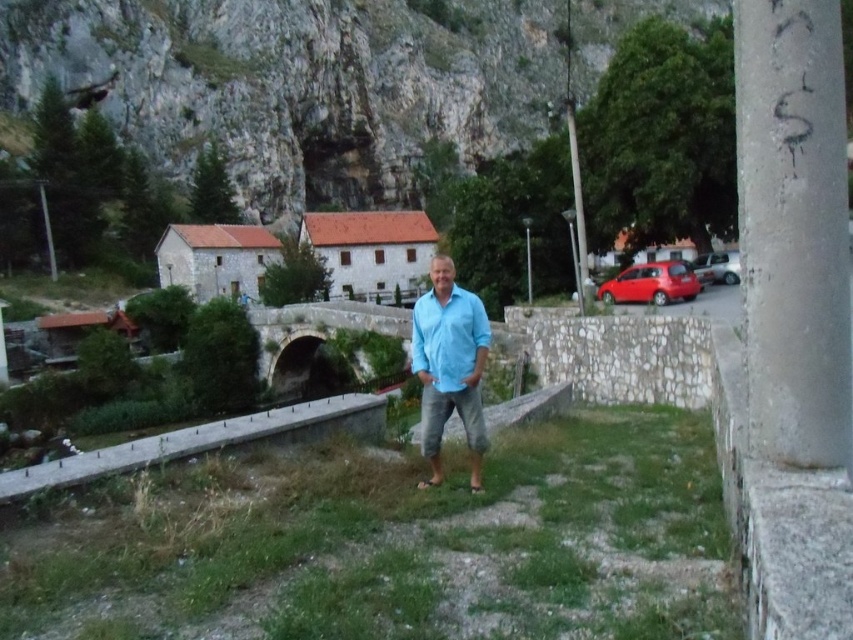
Question: Which of the following is the farthest from the observer?

Choices:
 (A) gray concrete pillar at right
 (B) silver metallic car at right

Answer: (B)

Question: Is gray concrete pillar at right above silver metallic car at right?

Choices:
 (A) yes
 (B) no

Answer: (A)

Question: Which of the following is the farthest from the observer?

Choices:
 (A) (727, 266)
 (B) (677, 285)
 (C) (351, 508)
 (D) (804, 243)

Answer: (A)

Question: Among these points, which one is farthest from the camera?

Choices:
 (A) (659, 262)
 (B) (816, 403)
 (C) (7, 541)
 (D) (442, 292)

Answer: (A)

Question: Can you confirm if green grass at center is positioned to the right of metallic pole at upper right?

Choices:
 (A) yes
 (B) no

Answer: (B)

Question: Does shiny red car at right have a larger size compared to metallic pole at upper right?

Choices:
 (A) no
 (B) yes

Answer: (A)